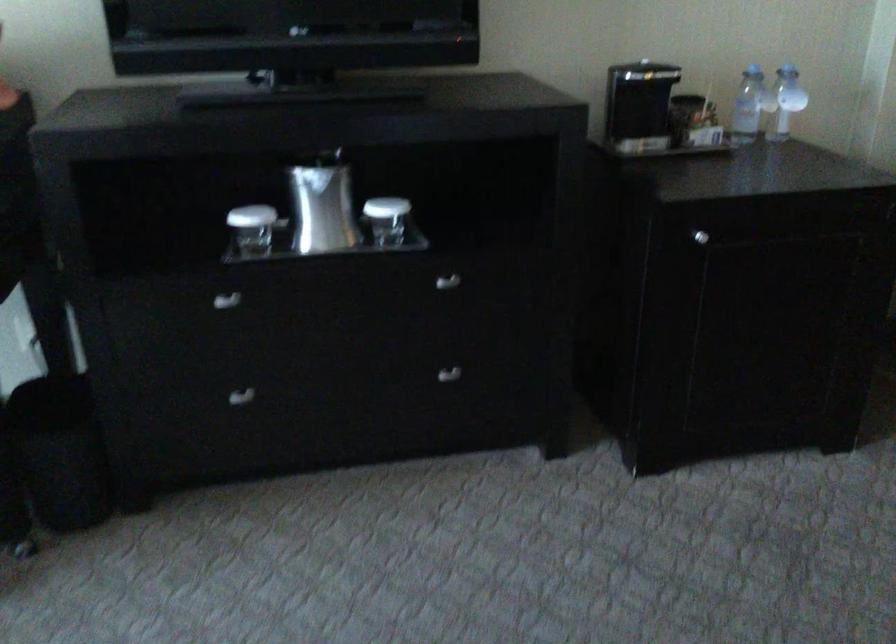
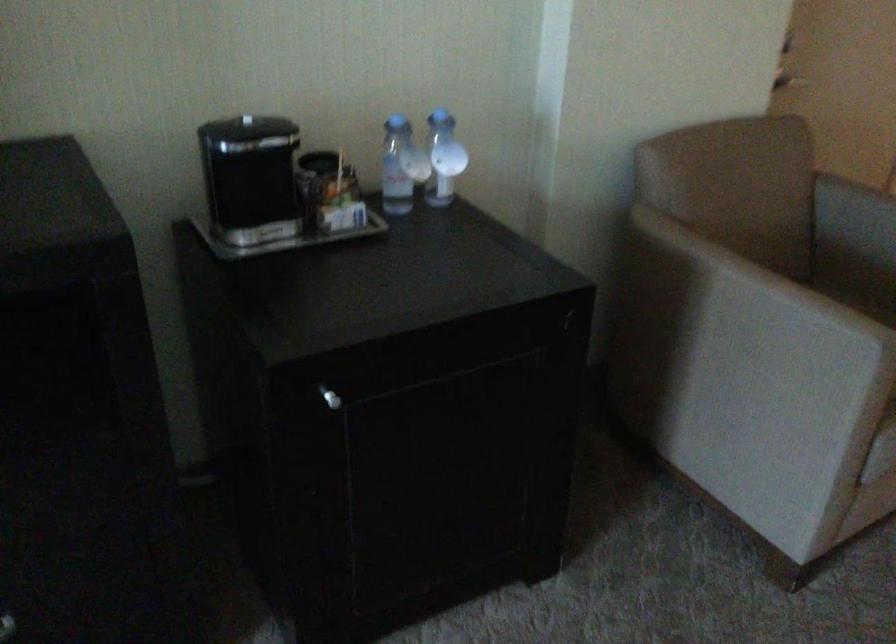
Find the pixel in the second image that matches pixel 756 89 in the first image.

(401, 166)